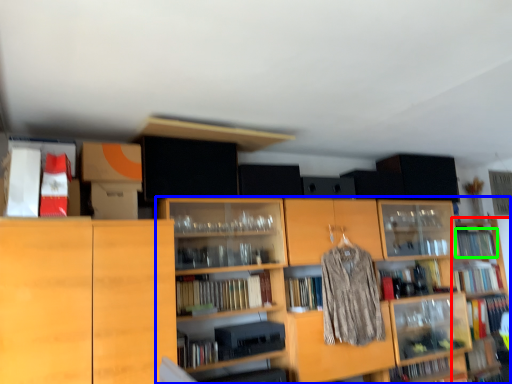
Question: Which is farther away from shelf (highlighted by a red box)? shelf (highlighted by a blue box) or book (highlighted by a green box)?

Choices:
 (A) shelf
 (B) book

Answer: (A)